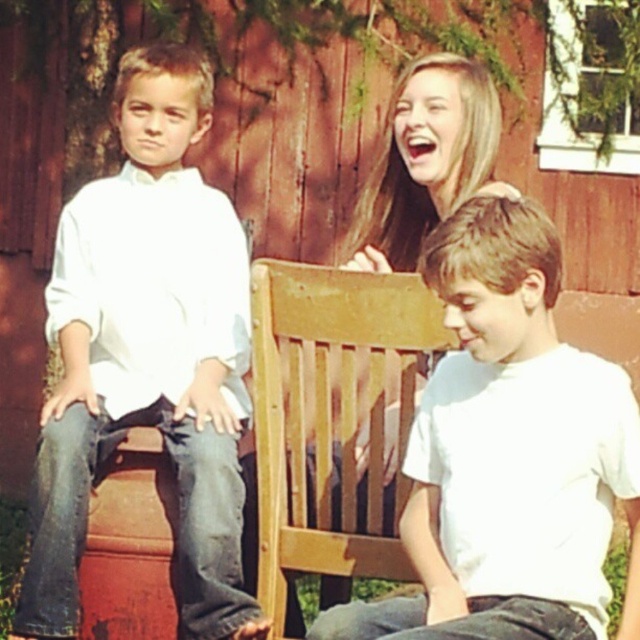
Question: Is matte white shirt at left positioned in front of white matte shirt at center?

Choices:
 (A) no
 (B) yes

Answer: (A)

Question: Can you confirm if matte white shirt at left is thinner than white matte shirt at center?

Choices:
 (A) yes
 (B) no

Answer: (A)

Question: Among these objects, which one is farthest from the camera?

Choices:
 (A) white matte shirt at center
 (B) matte white shirt at left

Answer: (B)

Question: Which object appears farthest from the camera in this image?

Choices:
 (A) white matte shirt at center
 (B) matte white shirt at left

Answer: (B)

Question: Does matte white shirt at left appear on the right side of white matte shirt at center?

Choices:
 (A) no
 (B) yes

Answer: (A)

Question: Which point is closer to the camera taking this photo?

Choices:
 (A) (579, 352)
 (B) (140, 387)

Answer: (A)